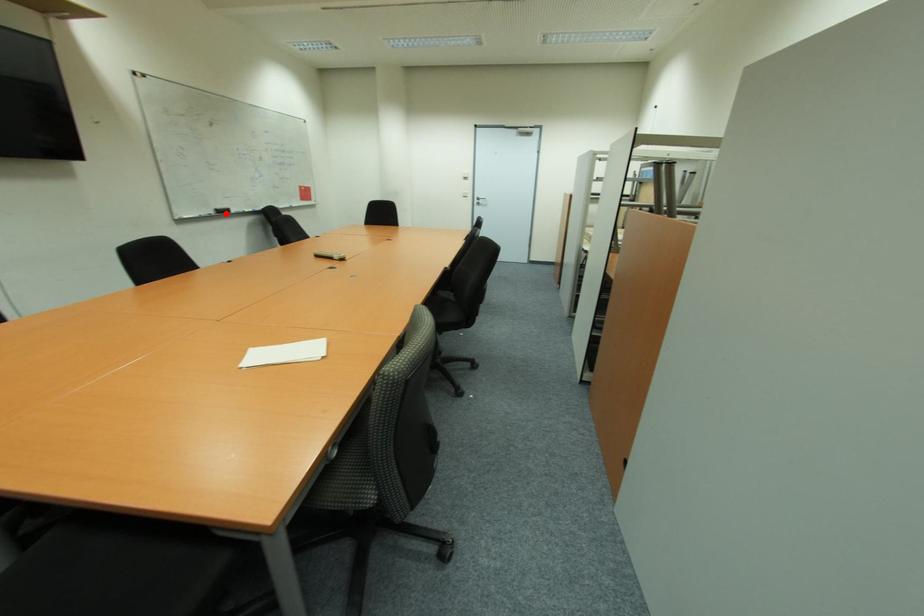
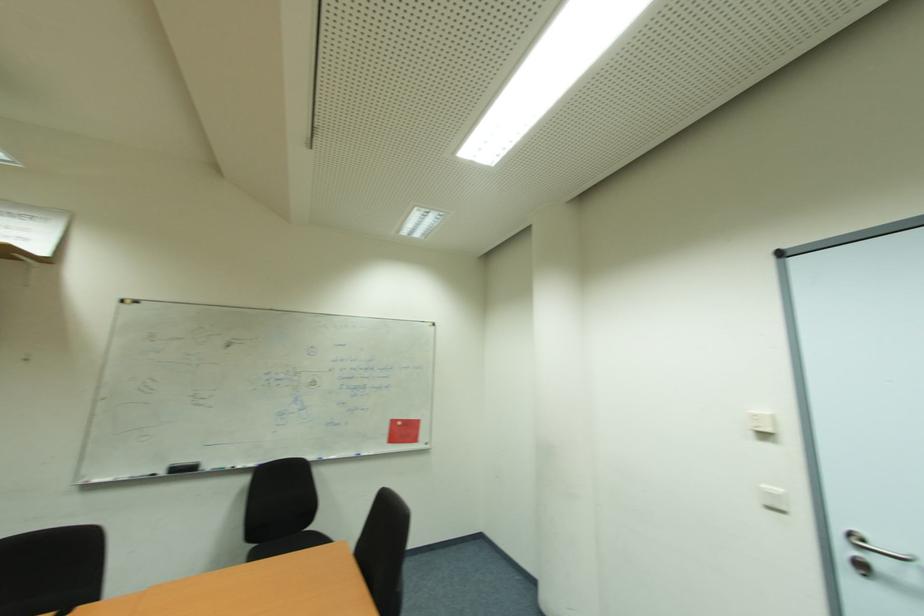
In the second image, find the point that corresponds to the highlighted location in the first image.

(189, 469)